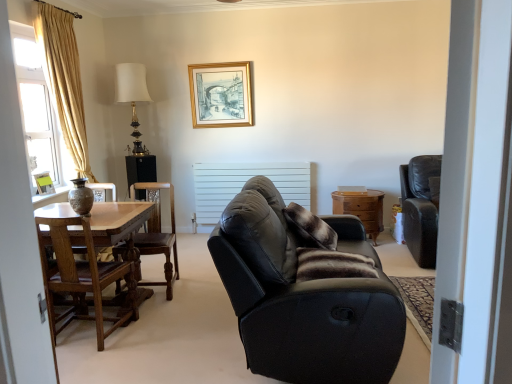
Find the location of `matte brown vase at left`. matte brown vase at left is located at coordinates (81, 197).

Locate an element on the screen. The height and width of the screenshot is (384, 512). wooden polished chair at center left, marked as the 2th chair in a front-to-back arrangement is located at coordinates (158, 234).

Where is `translucent glass window at left`? translucent glass window at left is located at coordinates (36, 107).

Describe the element at coordinates (36, 107) in the screenshot. I see `translucent glass window at left` at that location.

Find the location of a particular element. brown fur pillow at center, marked as the second pillow in a back-to-front arrangement is located at coordinates (332, 265).

This screenshot has width=512, height=384. I want to click on wooden chair at left, which appears as the first chair when viewed from the front, so click(x=83, y=272).

Is white matte radiator at center in contact with leather armchair at right, marked as the first chair in a back-to-front arrangement?

No.

Is white matte radiator at center taller or shorter than leather armchair at right, the third chair positioned from the front?

Clearly, white matte radiator at center is shorter compared to leather armchair at right, the third chair positioned from the front.

In the image, is white matte radiator at center positioned in front of or behind leather armchair at right, positioned as the first chair in right-to-left order?

Visually, white matte radiator at center is located behind leather armchair at right, positioned as the first chair in right-to-left order.

Measure the distance between white matte radiator at center and leather armchair at right, positioned as the first chair in right-to-left order.

white matte radiator at center and leather armchair at right, positioned as the first chair in right-to-left order, are 5.40 feet apart.

From the image's perspective, which one is positioned higher, leather armchair at right, marked as the first chair in a back-to-front arrangement, or wooden chair at left, marked as the first chair in a left-to-right arrangement?

leather armchair at right, marked as the first chair in a back-to-front arrangement, is shown above in the image.

The width and height of the screenshot is (512, 384). There is a leather armchair at right, the third chair from the left. What are the coordinates of `the 1st chair below it (from a real-world perspective)` in the screenshot? It's located at [83, 272].

Is leather armchair at right, the third chair from the left, closer to camera compared to wooden chair at left, marked as the first chair in a left-to-right arrangement?

That is False.

Is there a large distance between leather armchair at right, the third chair positioned from the front, and wooden chair at left, arranged as the 3th chair when viewed from the back?

Indeed, leather armchair at right, the third chair positioned from the front, is not near wooden chair at left, arranged as the 3th chair when viewed from the back.

Would you say white fabric lampshade at upper center is part of matte gold picture frame at left, which is the second picture frame from back to front,'s contents?

No, white fabric lampshade at upper center is located outside of matte gold picture frame at left, which is the second picture frame from back to front.

Is matte gold picture frame at left, which is counted as the 2th picture frame, starting from the top, far away from white fabric lampshade at upper center?

Yes, matte gold picture frame at left, which is counted as the 2th picture frame, starting from the top, and white fabric lampshade at upper center are located far from each other.

Who is taller, matte gold picture frame at left, positioned as the 1th picture frame in front-to-back order, or white fabric lampshade at upper center?

white fabric lampshade at upper center.

From a real-world perspective, is matte gold picture frame at left, marked as the first picture frame in a left-to-right arrangement, physically located above or below white fabric lampshade at upper center?

From a real-world perspective, matte gold picture frame at left, marked as the first picture frame in a left-to-right arrangement, is physically below white fabric lampshade at upper center.

Is matte brown vase at left at the back of white matte radiator at center?

No, white matte radiator at center's orientation is not away from matte brown vase at left.

Locate an element on the screen. vase on the left of white matte radiator at center is located at coordinates (81, 197).

Is point (234, 174) less distant than point (76, 200)?

No, (234, 174) is behind (76, 200).

Is white matte radiator at center next to matte brown vase at left and touching it?

white matte radiator at center and matte brown vase at left are not in contact.

Does point (282, 333) lie behind point (63, 245)?

No, it is not.

From a real-world perspective, is black leather couch at center below wooden chair at left, marked as the first chair in a left-to-right arrangement?

No, from a real-world perspective, black leather couch at center is not under wooden chair at left, marked as the first chair in a left-to-right arrangement.

Does black leather couch at center come in front of wooden chair at left, the third chair in the right-to-left sequence?

Yes, it is in front of wooden chair at left, the third chair in the right-to-left sequence.

Looking at this image, is matte brown vase at left a part of translucent glass window at left?

No, matte brown vase at left is not a part of translucent glass window at left.

Locate an element on the screen. window on the left of matte brown vase at left is located at coordinates (36, 107).

Considering the sizes of translucent glass window at left and matte brown vase at left in the image, is translucent glass window at left taller or shorter than matte brown vase at left?

translucent glass window at left is taller than matte brown vase at left.

From a real-world perspective, does matte brown vase at left sit lower than brown fur pillow at center, marked as the second pillow in a back-to-front arrangement?

Actually, matte brown vase at left is physically above brown fur pillow at center, marked as the second pillow in a back-to-front arrangement, in the real world.

Based on the photo, is matte brown vase at left placed right next to brown fur pillow at center, marked as the second pillow in a back-to-front arrangement?

matte brown vase at left and brown fur pillow at center, marked as the second pillow in a back-to-front arrangement, are not in contact.

From the image's perspective, is matte brown vase at left located beneath brown fur pillow at center, marked as the second pillow in a back-to-front arrangement?

Actually, matte brown vase at left appears above brown fur pillow at center, marked as the second pillow in a back-to-front arrangement, in the image.

From the image's perspective, starting from the matte brown vase at left, which pillow is the 2nd one below? Please provide its 2D coordinates.

[(332, 265)]

Which chair is the 1st one when counting from the front of the white matte radiator at center? Please provide its 2D coordinates.

[(421, 207)]

You are a GUI agent. You are given a task and a screenshot of the screen. Output one action in this format:
    pyautogui.click(x=<x>, y=<y>)
    Task: Click on the 2nd chair above when counting from the wooden chair at left, the third chair in the right-to-left sequence (from the image's perspective)
    This screenshot has height=384, width=512.
    Given the screenshot: What is the action you would take?
    pyautogui.click(x=421, y=207)

Considering their positions, is wooden side table at right positioned further to leather armchair at right, the third chair positioned from the front, than white fabric lampshade at upper center?

white fabric lampshade at upper center is positioned further to the anchor leather armchair at right, the third chair positioned from the front.

From the image, which object appears to be nearer to matte black screen door at right, plush brown and white pillow at center, the 2th pillow in the front-to-back sequence, or black leather couch at center?

Among the two, black leather couch at center is located nearer to matte black screen door at right.

When comparing their distances from white fabric lampshade at upper center, does wooden side table at right or brown fur pillow at center, the first pillow viewed from the front, seem further?

brown fur pillow at center, the first pillow viewed from the front, lies further to white fabric lampshade at upper center than the other object.

From the image, which object appears to be nearer to matte brown vase at left, brown fur pillow at center, marked as the second pillow in a back-to-front arrangement, or black leather couch at center?

The object closer to matte brown vase at left is black leather couch at center.

Looking at the image, which one is located further to wooden chair at left, arranged as the 3th chair when viewed from the back, white matte radiator at center or wooden side table at right?

Based on the image, wooden side table at right appears to be further to wooden chair at left, arranged as the 3th chair when viewed from the back.

When comparing their distances from matte black screen door at right, does white fabric lampshade at upper center or wooden side table at right seem closer?

The object closer to matte black screen door at right is wooden side table at right.

Which object lies nearer to the anchor point wooden chair at left, the third chair in the right-to-left sequence, matte black screen door at right or black leather couch at center?

black leather couch at center.

Estimate the real-world distances between objects in this image. Which object is further from black leather couch at center, matte black screen door at right or wooden chair at left, arranged as the 3th chair when viewed from the back?

The object further to black leather couch at center is matte black screen door at right.

This screenshot has width=512, height=384. What are the coordinates of `lamp between translucent glass window at left and wooden side table at right` in the screenshot? It's located at (132, 96).

The height and width of the screenshot is (384, 512). What are the coordinates of `studio couch between wooden polished chair at center left, marked as the 2th chair in a front-to-back arrangement, and plush brown and white pillow at center, acting as the first pillow starting from the back, in the horizontal direction` in the screenshot? It's located at (304, 298).

What are the coordinates of `pillow between matte gold picture frame at left, which is the second picture frame from back to front, and brown fur pillow at center, the first pillow viewed from the front` in the screenshot? It's located at (310, 228).

The width and height of the screenshot is (512, 384). What are the coordinates of `lamp situated between translucent glass window at left and plush brown and white pillow at center, acting as the first pillow starting from the back, from left to right` in the screenshot? It's located at (132, 96).